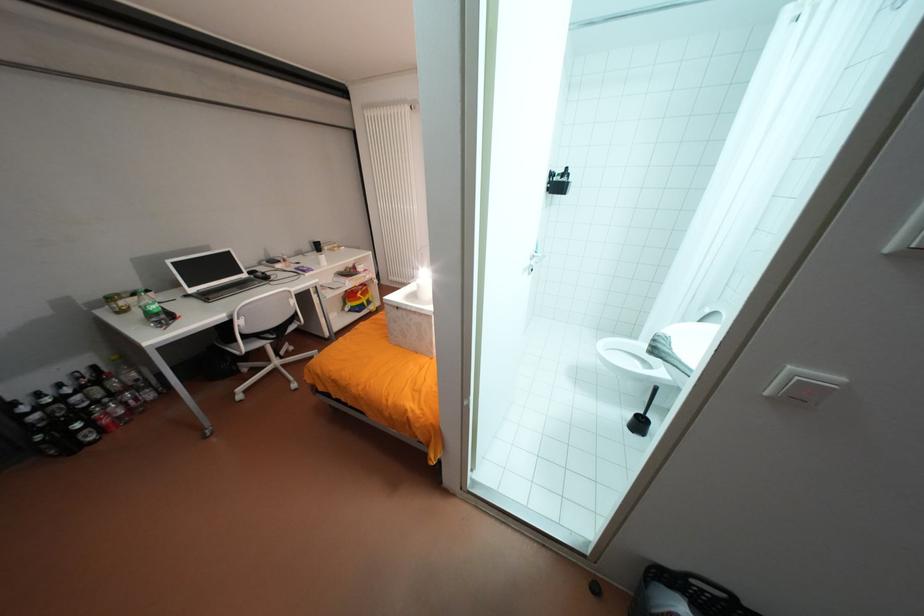
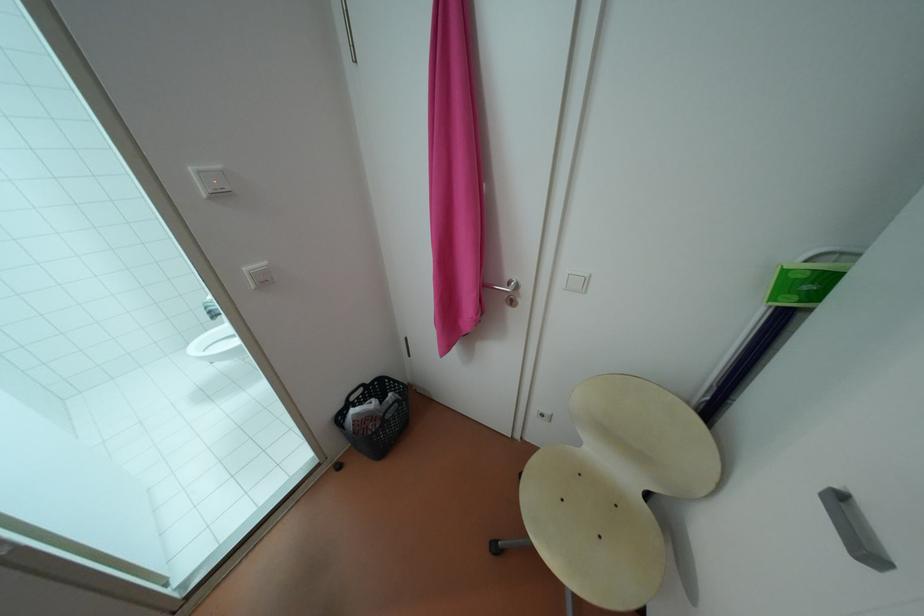
First-person continuous shooting, in which direction is the camera rotating?

The camera rotated toward right-down.